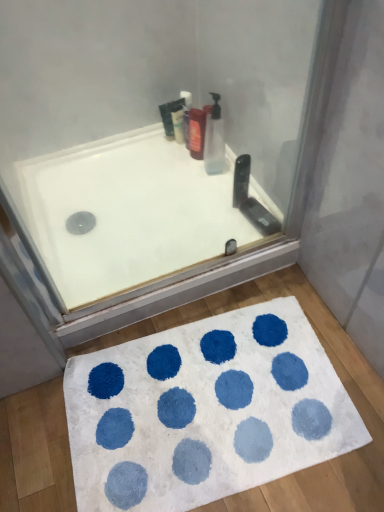
Identify the location of white shaggy bath mat at lower center. The width and height of the screenshot is (384, 512). (205, 411).

Describe the element at coordinates (186, 116) in the screenshot. Image resolution: width=384 pixels, height=512 pixels. I see `translucent plastic bottle at upper center, which is counted as the 1th cleaning product, starting from the back` at that location.

Image resolution: width=384 pixels, height=512 pixels. What do you see at coordinates (128, 213) in the screenshot? I see `white glossy bathtub at upper center` at bounding box center [128, 213].

Image resolution: width=384 pixels, height=512 pixels. In order to click on white glossy bathtub at upper center in this screenshot , I will do `click(128, 213)`.

This screenshot has height=512, width=384. What are the coordinates of `shiny plastic soap dispenser at upper center` in the screenshot? It's located at (197, 132).

Does point (103, 252) come in front of point (223, 163)?

Yes, point (103, 252) is in front of point (223, 163).

Is white glossy bathtub at upper center directly adjacent to translucent plastic bottle at upper center, the first cleaning product viewed from the right?

They are not placed beside each other.

Looking at this image, from a real-world perspective, does white glossy bathtub at upper center sit lower than translucent plastic bottle at upper center, which is the 1th cleaning product from front to back?

Yes.

Locate an element on the screen. This screenshot has height=512, width=384. bath mat that appears below the shiny plastic soap dispenser at upper center (from the image's perspective) is located at coordinates (205, 411).

Is shiny plastic soap dispenser at upper center wider than white shaggy bath mat at lower center?

Incorrect, the width of shiny plastic soap dispenser at upper center does not surpass that of white shaggy bath mat at lower center.

Relative to white shaggy bath mat at lower center, is shiny plastic soap dispenser at upper center in front or behind?

Visually, shiny plastic soap dispenser at upper center is located behind white shaggy bath mat at lower center.

Is translucent plastic bottle at upper center, the first cleaning product viewed from the right, wider or thinner than translucent plastic bottle at upper center, the second cleaning product in the front-to-back sequence?

Considering their sizes, translucent plastic bottle at upper center, the first cleaning product viewed from the right, looks broader than translucent plastic bottle at upper center, the second cleaning product in the front-to-back sequence.

What's the angular difference between translucent plastic bottle at upper center, the first cleaning product viewed from the right, and translucent plastic bottle at upper center, the second cleaning product in the right-to-left sequence,'s facing directions?

2.45 degrees.

Is translucent plastic bottle at upper center, the first cleaning product viewed from the right, next to translucent plastic bottle at upper center, which appears as the 1th cleaning product when viewed from the left?

No, translucent plastic bottle at upper center, the first cleaning product viewed from the right, is not next to translucent plastic bottle at upper center, which appears as the 1th cleaning product when viewed from the left.

From the image's perspective, which is above, translucent plastic bottle at upper center, which is the second cleaning product in left-to-right order, or translucent plastic bottle at upper center, which appears as the 1th cleaning product when viewed from the left?

translucent plastic bottle at upper center, which appears as the 1th cleaning product when viewed from the left, from the image's perspective.

Considering their positions, is translucent plastic bottle at upper center, which is the 1th cleaning product from front to back, located in front of or behind shiny plastic soap dispenser at upper center?

Visually, translucent plastic bottle at upper center, which is the 1th cleaning product from front to back, is located in front of shiny plastic soap dispenser at upper center.

Does point (215, 114) lie behind point (196, 154)?

No, (215, 114) is in front of (196, 154).

Would you consider translucent plastic bottle at upper center, which is the 1th cleaning product from front to back, to be distant from shiny plastic soap dispenser at upper center?

That's not correct — translucent plastic bottle at upper center, which is the 1th cleaning product from front to back, is a little close to shiny plastic soap dispenser at upper center.

Locate an element on the screen. This screenshot has width=384, height=512. toiletry below the translucent plastic bottle at upper center, which appears as the 2th cleaning product when viewed from the back (from a real-world perspective) is located at coordinates (197, 132).

Is shiny plastic soap dispenser at upper center not inside white glossy bathtub at upper center?

shiny plastic soap dispenser at upper center lies outside white glossy bathtub at upper center's area.

Is shiny plastic soap dispenser at upper center in front of or behind white glossy bathtub at upper center in the image?

shiny plastic soap dispenser at upper center is positioned farther from the viewer than white glossy bathtub at upper center.

The height and width of the screenshot is (512, 384). Find the location of `toiletry located on the right of white glossy bathtub at upper center`. toiletry located on the right of white glossy bathtub at upper center is located at coordinates (197, 132).

From a real-world perspective, between shiny plastic soap dispenser at upper center and white glossy bathtub at upper center, who is vertically higher?

From a 3D spatial view, shiny plastic soap dispenser at upper center is above.

From a real-world perspective, which cleaning product is the 1st one above the shiny plastic soap dispenser at upper center? Please provide its 2D coordinates.

[(186, 116)]

Is translucent plastic bottle at upper center, which appears as the 1th cleaning product when viewed from the left, at the back of shiny plastic soap dispenser at upper center?

No, shiny plastic soap dispenser at upper center's orientation is not away from translucent plastic bottle at upper center, which appears as the 1th cleaning product when viewed from the left.

Is translucent plastic bottle at upper center, which appears as the 2th cleaning product when viewed from the back, inside the boundaries of white glossy bathtub at upper center, or outside?

translucent plastic bottle at upper center, which appears as the 2th cleaning product when viewed from the back, lies outside white glossy bathtub at upper center.

This screenshot has height=512, width=384. In the image, there is a translucent plastic bottle at upper center, the first cleaning product viewed from the right. What are the coordinates of `bathtub below it (from the image's perspective)` in the screenshot? It's located at (128, 213).

Is translucent plastic bottle at upper center, which is the second cleaning product in left-to-right order, to the right of white glossy bathtub at upper center from the viewer's perspective?

Yes.

Considering the sizes of objects translucent plastic bottle at upper center, which is the 1th cleaning product from front to back, and white glossy bathtub at upper center in the image provided, who is thinner, translucent plastic bottle at upper center, which is the 1th cleaning product from front to back, or white glossy bathtub at upper center?

With smaller width is translucent plastic bottle at upper center, which is the 1th cleaning product from front to back.

What are the coordinates of `bathtub in front of the translucent plastic bottle at upper center, which appears as the 2th cleaning product when viewed from the back` in the screenshot? It's located at (128, 213).

Where is `toiletry on the left of white shaggy bath mat at lower center`? This screenshot has width=384, height=512. toiletry on the left of white shaggy bath mat at lower center is located at coordinates (197, 132).

When comparing their distances from translucent plastic bottle at upper center, which is the 1th cleaning product from front to back, does translucent plastic bottle at upper center, which is counted as the 1th cleaning product, starting from the back, or white shaggy bath mat at lower center seem further?

Based on the image, white shaggy bath mat at lower center appears to be further to translucent plastic bottle at upper center, which is the 1th cleaning product from front to back.

Which object lies nearer to the anchor point translucent plastic bottle at upper center, which is the second cleaning product in left-to-right order, white glossy bathtub at upper center or white shaggy bath mat at lower center?

white glossy bathtub at upper center is positioned closer to the anchor translucent plastic bottle at upper center, which is the second cleaning product in left-to-right order.

Which object lies nearer to the anchor point white glossy bathtub at upper center, shiny plastic soap dispenser at upper center or translucent plastic bottle at upper center, which appears as the 1th cleaning product when viewed from the left?

shiny plastic soap dispenser at upper center is closer to white glossy bathtub at upper center.

Estimate the real-world distances between objects in this image. Which object is further from translucent plastic bottle at upper center, the first cleaning product viewed from the right, translucent plastic bottle at upper center, which is counted as the 1th cleaning product, starting from the back, or white glossy bathtub at upper center?

white glossy bathtub at upper center is further to translucent plastic bottle at upper center, the first cleaning product viewed from the right.

Estimate the real-world distances between objects in this image. Which object is closer to translucent plastic bottle at upper center, which is counted as the 1th cleaning product, starting from the back, white glossy bathtub at upper center or shiny plastic soap dispenser at upper center?

The object closer to translucent plastic bottle at upper center, which is counted as the 1th cleaning product, starting from the back, is shiny plastic soap dispenser at upper center.

Which object lies further to the anchor point white glossy bathtub at upper center, translucent plastic bottle at upper center, which appears as the 1th cleaning product when viewed from the left, or white shaggy bath mat at lower center?

Based on the image, white shaggy bath mat at lower center appears to be further to white glossy bathtub at upper center.

Looking at the image, which one is located further to white glossy bathtub at upper center, translucent plastic bottle at upper center, which appears as the 2th cleaning product when viewed from the back, or white shaggy bath mat at lower center?

Among the two, white shaggy bath mat at lower center is located further to white glossy bathtub at upper center.

Looking at the image, which one is located closer to translucent plastic bottle at upper center, which appears as the 2th cleaning product when viewed from the back, translucent plastic bottle at upper center, which is counted as the 1th cleaning product, starting from the back, or shiny plastic soap dispenser at upper center?

The object closer to translucent plastic bottle at upper center, which appears as the 2th cleaning product when viewed from the back, is shiny plastic soap dispenser at upper center.

Find the location of a particular element. toiletry located between white glossy bathtub at upper center and translucent plastic bottle at upper center, which is counted as the 1th cleaning product, starting from the back, in the depth direction is located at coordinates (197, 132).

Where is `toiletry between translucent plastic bottle at upper center, the second cleaning product in the front-to-back sequence, and white shaggy bath mat at lower center in the up-down direction`? toiletry between translucent plastic bottle at upper center, the second cleaning product in the front-to-back sequence, and white shaggy bath mat at lower center in the up-down direction is located at coordinates (197, 132).

Identify the location of cleaning product that lies between shiny plastic soap dispenser at upper center and white shaggy bath mat at lower center from top to bottom. (214, 139).

Find the location of a particular element. The width and height of the screenshot is (384, 512). cleaning product between translucent plastic bottle at upper center, which is counted as the 1th cleaning product, starting from the back, and white shaggy bath mat at lower center vertically is located at coordinates (214, 139).